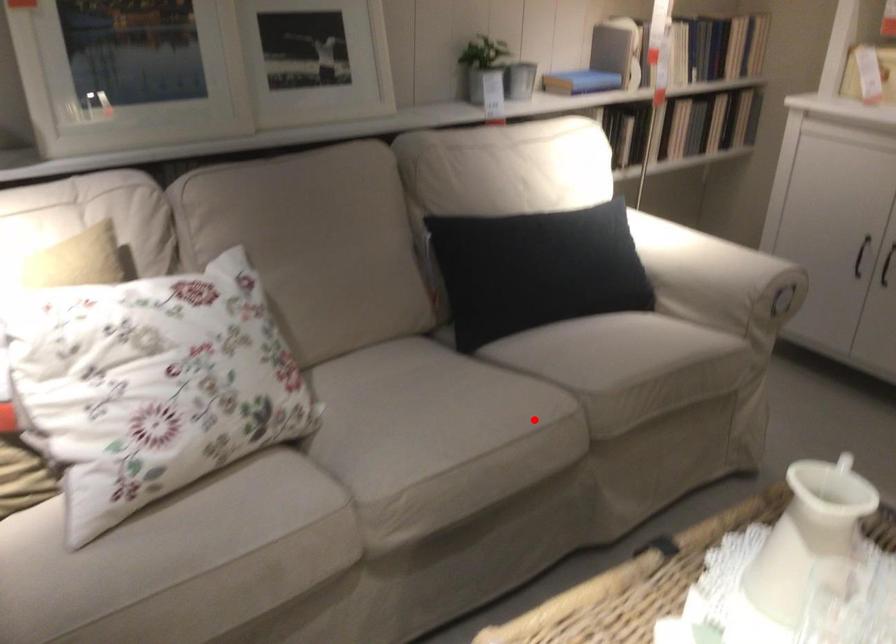
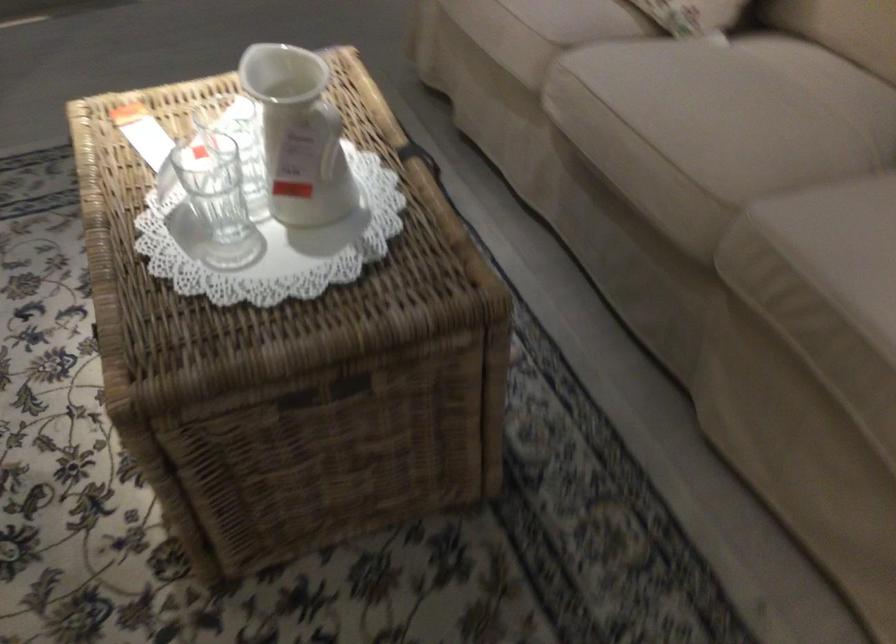
The point at the highlighted location is marked in the first image. Where is the corresponding point in the second image?

(704, 167)